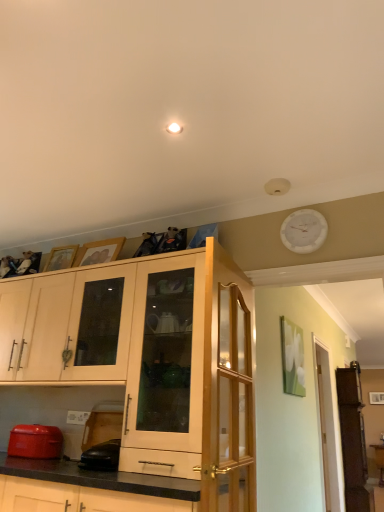
Question: Is clear glass door at right, which is the 2th glass door in left-to-right order, situated inside black rubber mouse at lower left, the 1th appliance positioned from the right, or outside?

Choices:
 (A) outside
 (B) inside

Answer: (A)

Question: Relative to black rubber mouse at lower left, which ranks as the 2th appliance in left-to-right order, is clear glass door at right, which ranks as the first glass door in back-to-front order, in front or behind?

Choices:
 (A) behind
 (B) front

Answer: (A)

Question: Estimate the real-world distances between objects in this image. Which object is farther from the matte red toaster at lower left, which is the second appliance from right to left?

Choices:
 (A) matte wood cabinets at upper left, marked as the second cabinetry in a right-to-left arrangement
 (B) matte wood cabinet at center, the 2th cabinetry positioned from the left
 (C) clear glass door at right, which is the 2th glass door in left-to-right order
 (D) clear wood glass door at upper center, marked as the second glass door in a back-to-front arrangement
 (E) white plastic clock at upper right

Answer: (C)

Question: Which is farther from the matte wood cabinet at center, the 2th cabinetry positioned from the left?

Choices:
 (A) clear glass door at right, positioned as the second glass door in front-to-back order
 (B) matte wood cabinets at upper left, positioned as the first cabinetry in left-to-right order
 (C) white plastic clock at upper right
 (D) clear wood glass door at upper center, the first glass door when ordered from front to back
 (E) matte red toaster at lower left, marked as the first appliance in a left-to-right arrangement

Answer: (A)